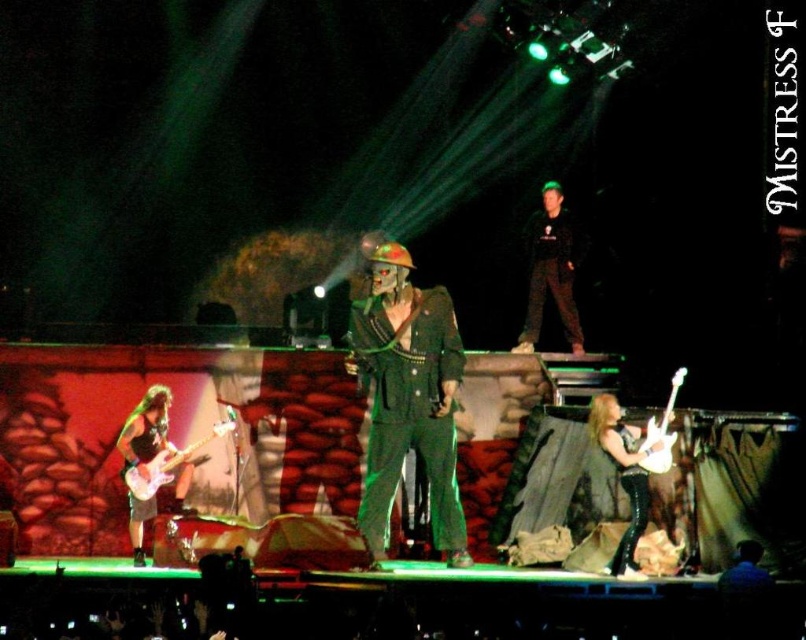
You are a stagehand preparing to adjust the lighting for the performer wearing the green matte suit at center and the black matte pants at center. Based on the description, which part of the performer might require wider lighting coverage?

The green matte suit at center might require wider lighting coverage since it is described as wider than the black matte pants at center.

You are a stagehand standing at the center of the stage. You need to quickly move a heavy equipment to the location of the green matte suit at center. Where should you move it to?

The green matte suit at center is located at the 2D coordinates point (408,397), so you should move the equipment to that exact point.

You are a stagehand who needs to adjust the lighting for the performer wearing the black matte pants at center and the shiny black guitar at lower left. Since the guitar is lower, will you need to angle the spotlight higher or lower to focus on the pants?

The black matte pants at center is positioned over the shiny black guitar at lower left, meaning the pants are higher. To focus on the pants, you should angle the spotlight higher than the guitar.